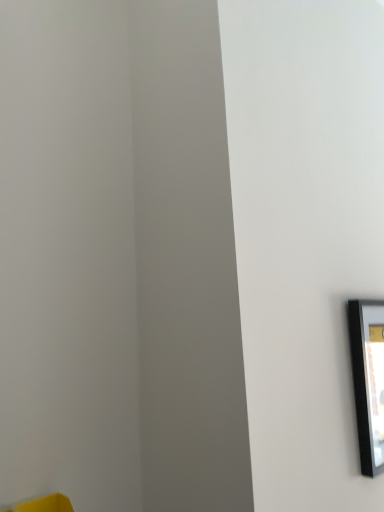
Measure the distance between black glossy picture frame at right and camera.

black glossy picture frame at right and camera are 3.36 feet apart from each other.

In order to face black glossy picture frame at right, should I rotate leftwards or rightwards?

You should look right and rotate roughly 24.793 degrees.

The height and width of the screenshot is (512, 384). What are the coordinates of `black glossy picture frame at right` in the screenshot? It's located at (368, 380).

What do you see at coordinates (368, 380) in the screenshot? I see `black glossy picture frame at right` at bounding box center [368, 380].

Image resolution: width=384 pixels, height=512 pixels. Find the location of `black glossy picture frame at right`. black glossy picture frame at right is located at coordinates (368, 380).